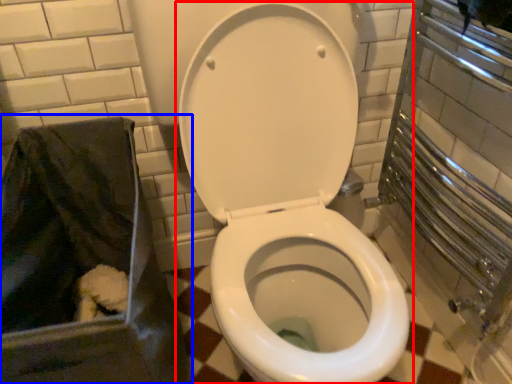
Question: Which of the following is the closest to the observer, toilet (highlighted by a red box) or recycling bin (highlighted by a blue box)?

Choices:
 (A) toilet
 (B) recycling bin

Answer: (A)